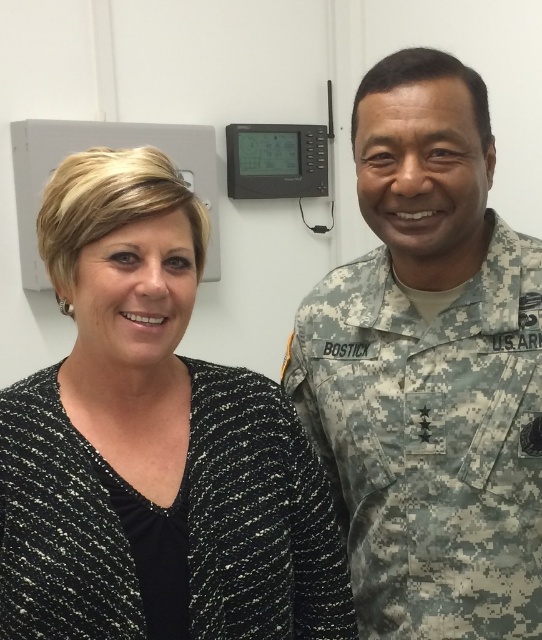
You are an assistant analyzing the image. The black speckled sweater at left is part of the scene. Can you determine its exact position using the coordinate system provided?

The black speckled sweater at left is located at point 0.697 in the x coordinate and 0.284 in the y coordinate.